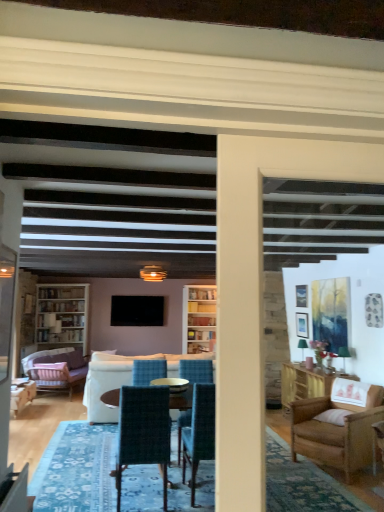
What do you see at coordinates (137, 310) in the screenshot? I see `flat screen tv at center` at bounding box center [137, 310].

This screenshot has height=512, width=384. Describe the element at coordinates (143, 432) in the screenshot. I see `velvet teal chair at center, the 2th chair positioned from the left` at that location.

Find the location of a particular element. flat screen tv at center is located at coordinates (137, 310).

Considering the relative sizes of white wood bookcase at left and flat screen tv at center in the image provided, is white wood bookcase at left bigger than flat screen tv at center?

Correct, white wood bookcase at left is larger in size than flat screen tv at center.

Is flat screen tv at center a part of white wood bookcase at left?

No, white wood bookcase at left does not contain flat screen tv at center.

Based on the photo, can you tell me how much white wood bookcase at left and flat screen tv at center differ in facing direction?

The facing directions of white wood bookcase at left and flat screen tv at center are 0.537 degrees apart.

Considering their positions, is flat screen tv at center located in front of or behind velvet teal chair at center, marked as the second chair in a front-to-back arrangement?

In the image, flat screen tv at center appears behind velvet teal chair at center, marked as the second chair in a front-to-back arrangement.

Is flat screen tv at center facing towards velvet teal chair at center, placed as the 1th chair when sorted from right to left?

Yes, flat screen tv at center is facing velvet teal chair at center, placed as the 1th chair when sorted from right to left.

From the image's perspective, which one is positioned higher, flat screen tv at center or velvet teal chair at center, marked as the second chair in a front-to-back arrangement?

From the image's view, flat screen tv at center is above.

Between flat screen tv at center and velvet teal chair at center, placed as the 1th chair when sorted from right to left, which one has less height?

flat screen tv at center is shorter.

In the scene shown: Considering the relative sizes of velvet teal chair at center, placed as the 1th chair when sorted from right to left, and velvet teal chair at center, the 2th chair viewed from the right, in the image provided, is velvet teal chair at center, placed as the 1th chair when sorted from right to left, thinner than velvet teal chair at center, the 2th chair viewed from the right,?

Yes, velvet teal chair at center, placed as the 1th chair when sorted from right to left, is thinner than velvet teal chair at center, the 2th chair viewed from the right.

Can you confirm if velvet teal chair at center, which is counted as the second chair, starting from the back, is bigger than velvet teal chair at center, the first chair from the front?

No, velvet teal chair at center, which is counted as the second chair, starting from the back, is not bigger than velvet teal chair at center, the first chair from the front.

Considering the relative positions of velvet teal chair at center, which is counted as the second chair, starting from the back, and velvet teal chair at center, the 2th chair viewed from the right, in the image provided, is velvet teal chair at center, which is counted as the second chair, starting from the back, to the left or to the right of velvet teal chair at center, the 2th chair viewed from the right,?

In the image, velvet teal chair at center, which is counted as the second chair, starting from the back, appears on the right side of velvet teal chair at center, the 2th chair viewed from the right.

Is velvet teal chair at center, which is counted as the second chair, starting from the back, inside or outside of velvet teal chair at center, the first chair from the front?

velvet teal chair at center, which is counted as the second chair, starting from the back, is spatially situated outside velvet teal chair at center, the first chair from the front.

How distant is white wood bookcase at left from velvet pink armchair at lower left, acting as the third chair starting from the front?

white wood bookcase at left and velvet pink armchair at lower left, acting as the third chair starting from the front, are 1.18 meters apart from each other.

Which of these two, white wood bookcase at left or velvet pink armchair at lower left, acting as the third chair starting from the front, is bigger?

With larger size is white wood bookcase at left.

Considering the relative sizes of white wood bookcase at left and velvet pink armchair at lower left, which is counted as the 1th chair, starting from the back, in the image provided, is white wood bookcase at left thinner than velvet pink armchair at lower left, which is counted as the 1th chair, starting from the back,?

Correct, the width of white wood bookcase at left is less than that of velvet pink armchair at lower left, which is counted as the 1th chair, starting from the back.

How many degrees apart are the facing directions of white wood bookcase at left and velvet pink armchair at lower left, the first chair viewed from the left?

white wood bookcase at left and velvet pink armchair at lower left, the first chair viewed from the left, are facing 87.2 degrees away from each other.

Which point is more distant from viewer, [87,405] or [197,424]?

The point [87,405] is farther.

Which is in front, white fabric couch at center, the second studio couch from the back, or velvet teal chair at center, which is counted as the second chair, starting from the back?

velvet teal chair at center, which is counted as the second chair, starting from the back, is more forward.

Based on their sizes in the image, would you say white fabric couch at center, the second studio couch from the back, is bigger or smaller than velvet teal chair at center, marked as the second chair in a front-to-back arrangement?

Considering their sizes, white fabric couch at center, the second studio couch from the back, takes up more space than velvet teal chair at center, marked as the second chair in a front-to-back arrangement.

Can you see white fabric couch at center, the first studio couch from the front, touching velvet teal chair at center, which is counted as the second chair, starting from the back?

white fabric couch at center, the first studio couch from the front, and velvet teal chair at center, which is counted as the second chair, starting from the back, are not in contact.

Is velvet teal chair at center, which is counted as the 3th chair, starting from the left, bigger than white wood bookcase at left?

No, velvet teal chair at center, which is counted as the 3th chair, starting from the left, is not bigger than white wood bookcase at left.

Does velvet teal chair at center, placed as the 1th chair when sorted from right to left, appear on the right side of white wood bookcase at left?

Indeed, velvet teal chair at center, placed as the 1th chair when sorted from right to left, is positioned on the right side of white wood bookcase at left.

Is velvet teal chair at center, marked as the second chair in a front-to-back arrangement, facing away from white wood bookcase at left?

No, velvet teal chair at center, marked as the second chair in a front-to-back arrangement, is not facing away from white wood bookcase at left.

In terms of height, does velvet teal chair at center, placed as the 1th chair when sorted from right to left, look taller or shorter compared to white wood bookcase at left?

velvet teal chair at center, placed as the 1th chair when sorted from right to left, is shorter than white wood bookcase at left.

Does velvet pink armchair at lower left, acting as the 3th chair starting from the right, turn towards white wood bookcase at left?

No, velvet pink armchair at lower left, acting as the 3th chair starting from the right, is not turned towards white wood bookcase at left.

Considering the sizes of velvet pink armchair at lower left, which is counted as the 1th chair, starting from the back, and white wood bookcase at left in the image, is velvet pink armchair at lower left, which is counted as the 1th chair, starting from the back, wider or thinner than white wood bookcase at left?

Clearly, velvet pink armchair at lower left, which is counted as the 1th chair, starting from the back, has more width compared to white wood bookcase at left.

Measure the distance from velvet pink armchair at lower left, acting as the third chair starting from the front, to white wood bookcase at left.

3.86 feet.

Where is `bookcase above the velvet pink armchair at lower left, which is counted as the 1th chair, starting from the back (from a real-world perspective)`? bookcase above the velvet pink armchair at lower left, which is counted as the 1th chair, starting from the back (from a real-world perspective) is located at coordinates point(62,315).

Locate an element on the screen. television that appears behind the white wood bookcase at left is located at coordinates tap(137, 310).

Where is `the 2nd chair below the flat screen tv at center (from the image's perspective)`? The height and width of the screenshot is (512, 384). the 2nd chair below the flat screen tv at center (from the image's perspective) is located at coordinates (199, 432).

From the image, which object appears to be farther from velvet teal chair at center, the first chair from the front, velvet purple couch at left, the 1th studio couch positioned from the back, or velvet pink armchair at lower left, which is counted as the 1th chair, starting from the back?

Among the two, velvet purple couch at left, the 1th studio couch positioned from the back, is located further to velvet teal chair at center, the first chair from the front.

Based on the photo, which object lies nearer to the anchor point white wood bookcase at left, white fabric couch at center, acting as the second studio couch starting from the left, or velvet teal chair at center, which is counted as the second chair, starting from the back?

Based on the image, white fabric couch at center, acting as the second studio couch starting from the left, appears to be nearer to white wood bookcase at left.

Considering their positions, is velvet purple couch at left, which is counted as the 1th studio couch, starting from the left, positioned further to velvet pink armchair at lower left, acting as the third chair starting from the front, than velvet teal chair at center, the 2th chair viewed from the right?

velvet teal chair at center, the 2th chair viewed from the right.

Which object lies nearer to the anchor point flat screen tv at center, white fabric couch at center, the second studio couch from the back, or velvet pink armchair at lower left, which is counted as the 1th chair, starting from the back?

velvet pink armchair at lower left, which is counted as the 1th chair, starting from the back.

Estimate the real-world distances between objects in this image. Which object is further from white fabric couch at center, acting as the second studio couch starting from the left, velvet pink armchair at lower left, the first chair viewed from the left, or velvet teal chair at center, which is counted as the 3th chair, starting from the left?

The object further to white fabric couch at center, acting as the second studio couch starting from the left, is velvet pink armchair at lower left, the first chair viewed from the left.

When comparing their distances from flat screen tv at center, does velvet teal chair at center, marked as the second chair in a front-to-back arrangement, or white fabric couch at center, the first studio couch from the front, seem further?

velvet teal chair at center, marked as the second chair in a front-to-back arrangement, lies further to flat screen tv at center than the other object.

When comparing their distances from flat screen tv at center, does velvet purple couch at left, which is counted as the 1th studio couch, starting from the left, or velvet pink armchair at lower left, acting as the third chair starting from the front, seem further?

velvet pink armchair at lower left, acting as the third chair starting from the front, is further to flat screen tv at center.

Considering their positions, is velvet teal chair at center, placed as the 1th chair when sorted from right to left, positioned closer to velvet pink armchair at lower left, which is counted as the 1th chair, starting from the back, than velvet teal chair at center, the first chair from the front?

Among the two, velvet teal chair at center, the first chair from the front, is located nearer to velvet pink armchair at lower left, which is counted as the 1th chair, starting from the back.

Locate an element on the screen. This screenshot has width=384, height=512. chair between velvet teal chair at center, the 2th chair positioned from the left, and white fabric couch at center, acting as the second studio couch starting from the left, in the front-back direction is located at coordinates (199, 432).

This screenshot has width=384, height=512. I want to click on studio couch positioned between velvet teal chair at center, the first chair from the front, and velvet purple couch at left, the 1th studio couch positioned from the back, from near to far, so click(x=121, y=379).

The height and width of the screenshot is (512, 384). In order to click on chair between velvet teal chair at center, which is counted as the 3th chair, starting from the left, and flat screen tv at center, along the z-axis in this screenshot , I will do `click(21, 394)`.

This screenshot has width=384, height=512. Identify the location of studio couch located between white fabric couch at center, the first studio couch from the front, and flat screen tv at center in the depth direction. (57, 369).